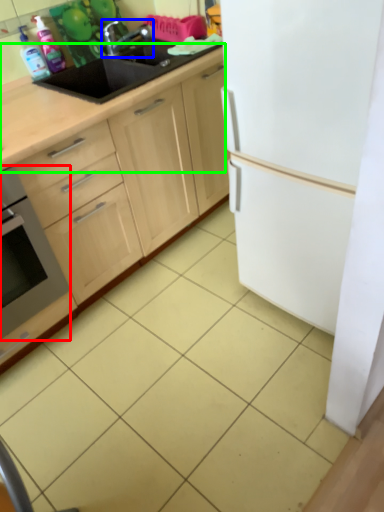
Question: Which is nearer to the home appliance (highlighted by a red box)? tap (highlighted by a blue box) or countertop (highlighted by a green box).

Choices:
 (A) tap
 (B) countertop

Answer: (B)